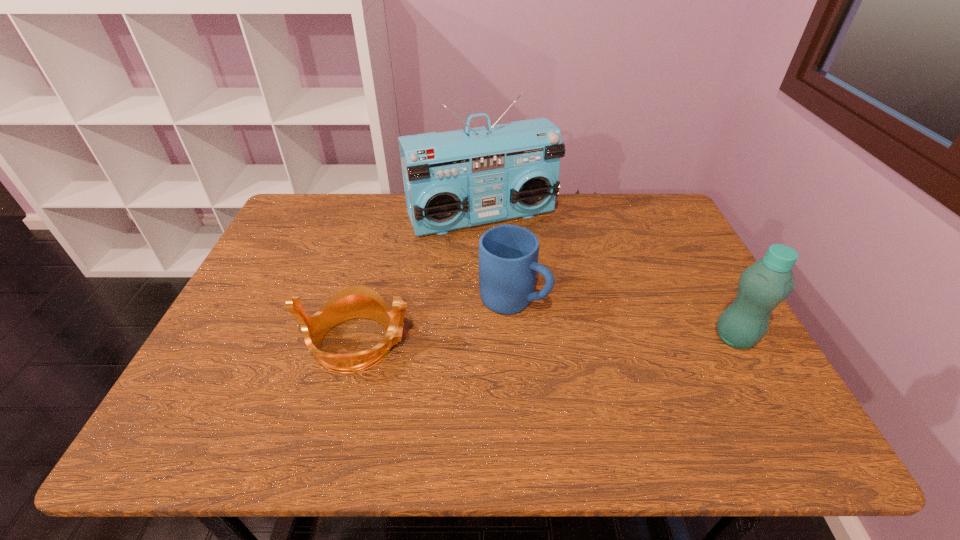
The width and height of the screenshot is (960, 540). Find the location of `vacant space that's between the tiara and the rightmost object`. vacant space that's between the tiara and the rightmost object is located at coordinates (546, 340).

The image size is (960, 540). What are the coordinates of `vacant area between the shortest object and the water bottle` in the screenshot? It's located at (x=546, y=340).

Locate an element on the screen. The image size is (960, 540). vacant region between the tiara and the water bottle is located at coordinates (546, 340).

Locate which object is the closest to the shortest object. Please provide its 2D coordinates. Your answer should be formatted as a tuple, i.e. [(x, y)], where the tuple contains the x and y coordinates of a point satisfying the conditions above.

[(508, 254)]

This screenshot has height=540, width=960. What are the coordinates of `object that stands as the third closest to the mug` in the screenshot? It's located at (762, 286).

The width and height of the screenshot is (960, 540). I want to click on vacant position in the image that satisfies the following two spatial constraints: 1. on the front side of the rightmost object; 2. at the front cap of the mug, so click(x=516, y=338).